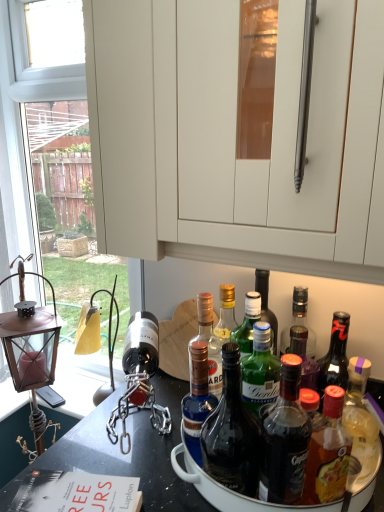
Question: Should I look upward or downward to see blue glass bottle at center, which is the 1th bottle from left to right?

Choices:
 (A) up
 (B) down

Answer: (B)

Question: Is translucent glass bottle at center, the third bottle in the left-to-right sequence, bigger than blue glass bottle at center, which appears as the 5th bottle when viewed from the right?

Choices:
 (A) no
 (B) yes

Answer: (B)

Question: From the image's perspective, is translucent glass bottle at center, the third bottle in the left-to-right sequence, located beneath blue glass bottle at center, which appears as the 5th bottle when viewed from the right?

Choices:
 (A) no
 (B) yes

Answer: (B)

Question: From a real-world perspective, is translucent glass bottle at center, the third bottle from the right, over blue glass bottle at center, which is the 1th bottle from left to right?

Choices:
 (A) no
 (B) yes

Answer: (B)

Question: Is translucent glass bottle at center, the third bottle from the right, completely or partially outside of blue glass bottle at center, which appears as the 5th bottle when viewed from the right?

Choices:
 (A) no
 (B) yes

Answer: (B)

Question: Does translucent glass bottle at center, the third bottle in the left-to-right sequence, have a smaller size compared to blue glass bottle at center, which appears as the 5th bottle when viewed from the right?

Choices:
 (A) no
 (B) yes

Answer: (A)

Question: Is the position of translucent glass bottle at center, the third bottle in the left-to-right sequence, more distant than that of blue glass bottle at center, which is the 1th bottle from left to right?

Choices:
 (A) yes
 (B) no

Answer: (B)

Question: Can you confirm if translucent glass bottle at center, the third bottle from the right, is taller than blue glass bottle at center, the 2th bottle when ordered from left to right?

Choices:
 (A) yes
 (B) no

Answer: (B)

Question: Are translucent glass bottle at center, the third bottle in the left-to-right sequence, and blue glass bottle at center, acting as the fourth bottle starting from the right, located far from each other?

Choices:
 (A) no
 (B) yes

Answer: (A)

Question: Considering the relative positions of translucent glass bottle at center, the third bottle in the left-to-right sequence, and blue glass bottle at center, the 2th bottle when ordered from left to right, in the image provided, is translucent glass bottle at center, the third bottle in the left-to-right sequence, to the left of blue glass bottle at center, the 2th bottle when ordered from left to right, from the viewer's perspective?

Choices:
 (A) no
 (B) yes

Answer: (A)

Question: Does translucent glass bottle at center, the third bottle from the right, have a greater width compared to blue glass bottle at center, the 2th bottle when ordered from left to right?

Choices:
 (A) no
 (B) yes

Answer: (B)

Question: Is translucent glass bottle at center, the third bottle in the left-to-right sequence, oriented away from blue glass bottle at center, the 2th bottle when ordered from left to right?

Choices:
 (A) yes
 (B) no

Answer: (B)

Question: Is translucent glass bottle at center, the third bottle in the left-to-right sequence, positioned before blue glass bottle at center, the 2th bottle when ordered from left to right?

Choices:
 (A) yes
 (B) no

Answer: (A)

Question: Does blue glass bottle at center, acting as the fourth bottle starting from the right, turn towards bronze lantern at left?

Choices:
 (A) yes
 (B) no

Answer: (B)